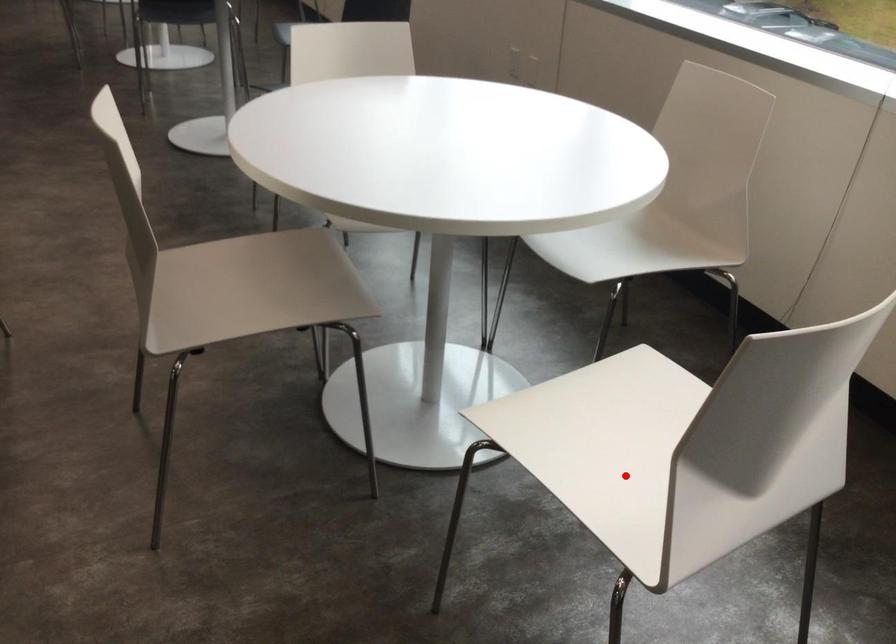
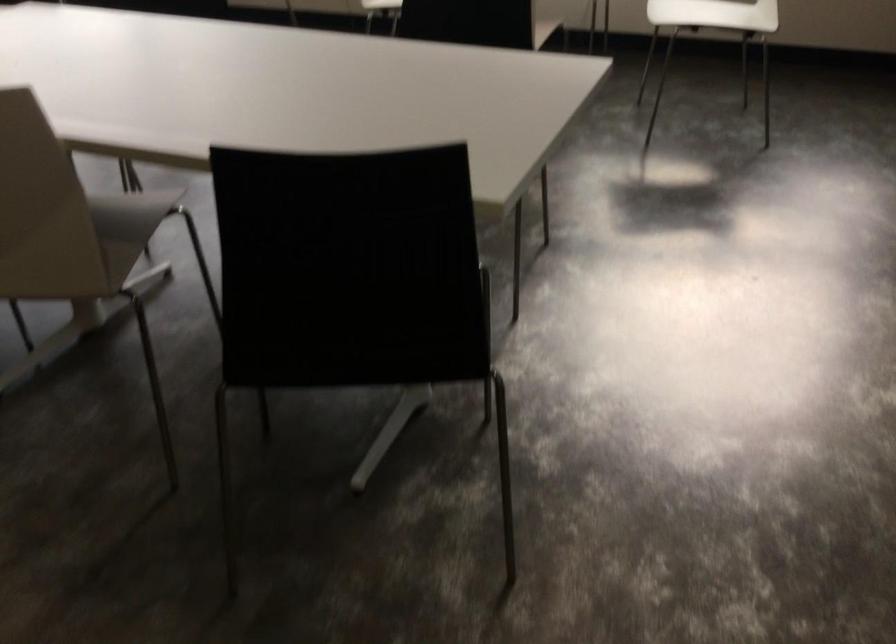
In the second image, find the point that corresponds to the highlighted location in the first image.

(714, 14)